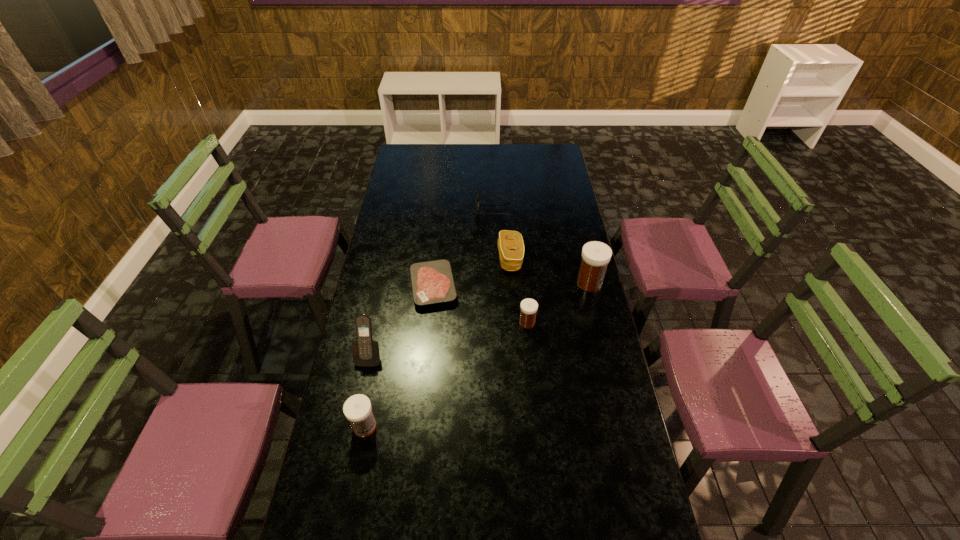
You are a GUI agent. You are given a task and a screenshot of the screen. Output one action in this format:
    pyautogui.click(x=<x>, y=<y>)
    Task: Click on the vacant space in between the farthest object and the rightmost object
    The image size is (960, 540).
    Given the screenshot: What is the action you would take?
    pyautogui.click(x=541, y=246)

Identify which object is located as the fifth nearest to the farthest object. Please provide its 2D coordinates. Your answer should be formatted as a tuple, i.e. [(x, y)], where the tuple contains the x and y coordinates of a point satisfying the conditions above.

[(366, 353)]

Locate which object ranks second in proximity to the second nearest medicine. Please provide its 2D coordinates. Your answer should be formatted as a tuple, i.e. [(x, y)], where the tuple contains the x and y coordinates of a point satisfying the conditions above.

[(510, 244)]

Select which medicine is the closest to the third tallest object. Please provide its 2D coordinates. Your answer should be formatted as a tuple, i.e. [(x, y)], where the tuple contains the x and y coordinates of a point satisfying the conditions above.

[(529, 307)]

Find the location of a particular element. medicine that is the closest to the shortest medicine is located at coordinates coord(596,255).

Find the location of `free space that satisfies the following two spatial constraints: 1. on the front-facing side of the rightmost object; 2. on the right side of the sunglasses`. free space that satisfies the following two spatial constraints: 1. on the front-facing side of the rightmost object; 2. on the right side of the sunglasses is located at coordinates [496, 283].

Identify the location of free point that satisfies the following two spatial constraints: 1. on the zipper side of the clutch bag; 2. on the right side of the second medicine from left to right. The height and width of the screenshot is (540, 960). point(515,322).

You are a GUI agent. You are given a task and a screenshot of the screen. Output one action in this format:
    pyautogui.click(x=<x>, y=<y>)
    Task: Click on the free space that satisfies the following two spatial constraints: 1. on the back side of the steak; 2. on the right side of the fifth shortest object
    
    Given the screenshot: What is the action you would take?
    pyautogui.click(x=392, y=286)

Where is `vacant region that satisfies the following two spatial constraints: 1. on the front-facing side of the sixth tallest object; 2. on the front-facing side of the cellular telephone`? The width and height of the screenshot is (960, 540). vacant region that satisfies the following two spatial constraints: 1. on the front-facing side of the sixth tallest object; 2. on the front-facing side of the cellular telephone is located at coordinates (499, 355).